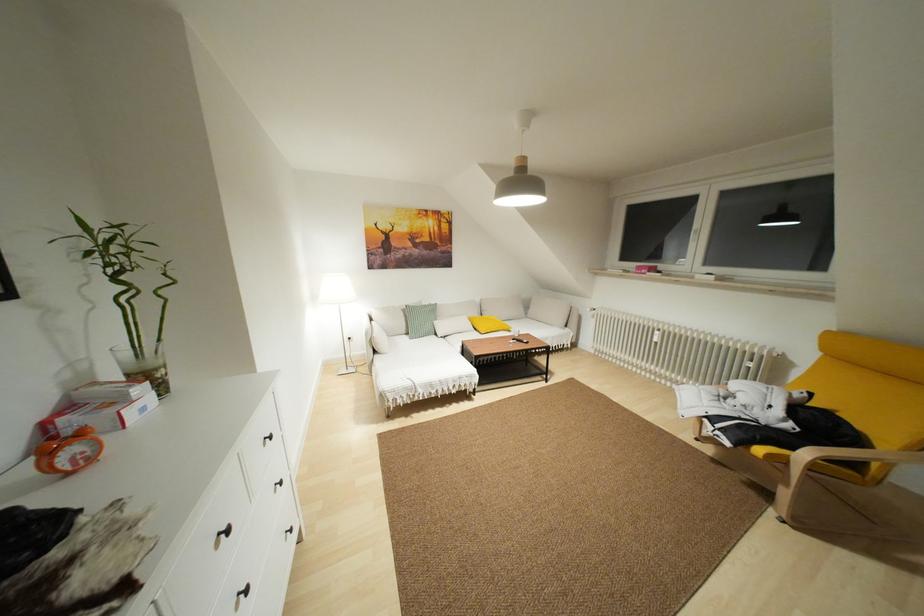
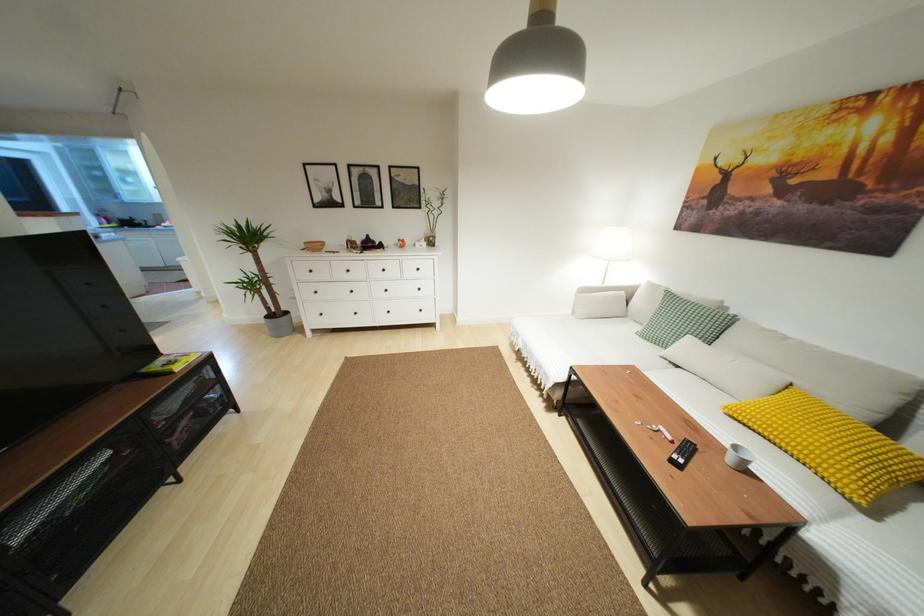
In the second image, find the point that corresponds to (290,530) in the first image.

(419, 310)